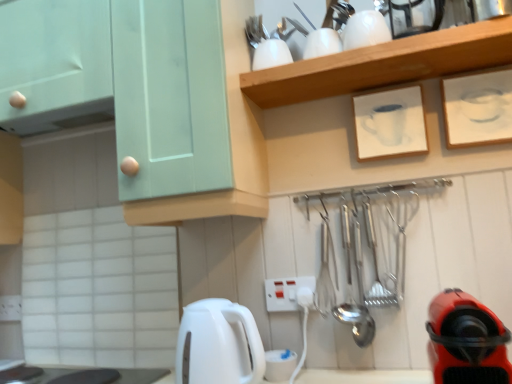
Question: Visually, is white matte picture frame at upper center, the second picture frame in the right-to-left sequence, positioned to the left or to the right of black glossy countertop at lower left?

Choices:
 (A) right
 (B) left

Answer: (A)

Question: Considering the positions of white matte picture frame at upper center, acting as the 1th picture frame starting from the left, and black glossy countertop at lower left in the image, is white matte picture frame at upper center, acting as the 1th picture frame starting from the left, taller or shorter than black glossy countertop at lower left?

Choices:
 (A) short
 (B) tall

Answer: (B)

Question: Considering the real-world distances, which object is farthest from the white paper at upper right, which is counted as the second picture frame, starting from the left?

Choices:
 (A) white plastic electric outlet at center
 (B) mint green cabinet at upper left
 (C) red rubber vacuum cleaner at lower right
 (D) white glossy cups at upper center
 (E) metallic silver kettle at upper right, which appears as the 1th appliance when viewed from the right

Answer: (A)

Question: Which object is positioned closest to the white glossy cups at upper center?

Choices:
 (A) mint green cabinet at upper left
 (B) white paper at upper right, which is counted as the second picture frame, starting from the left
 (C) white plastic electric outlet at center
 (D) white matte picture frame at upper center, acting as the 1th picture frame starting from the left
 (E) black glossy countertop at lower left

Answer: (D)